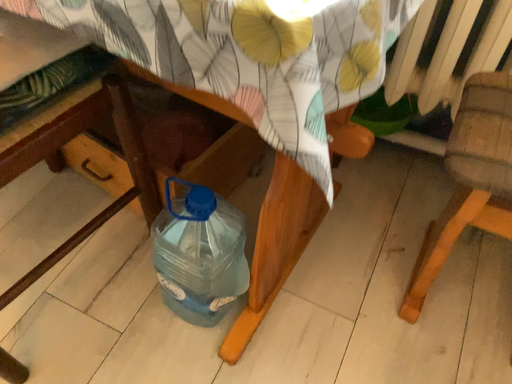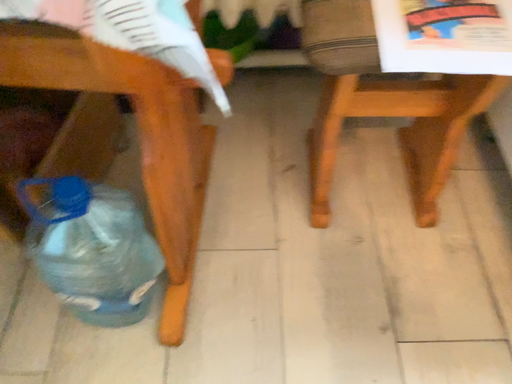
Question: How did the camera likely rotate when shooting the video?

Choices:
 (A) rotated left
 (B) rotated right

Answer: (B)